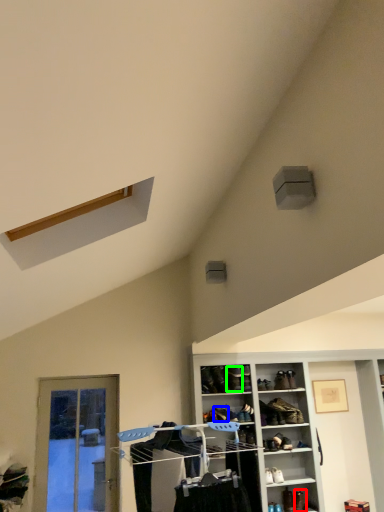
Question: Which object is the farthest from shoe (highlighted by a red box)? Choose among these: shoe (highlighted by a blue box) or shoe (highlighted by a green box).

Choices:
 (A) shoe
 (B) shoe

Answer: (B)